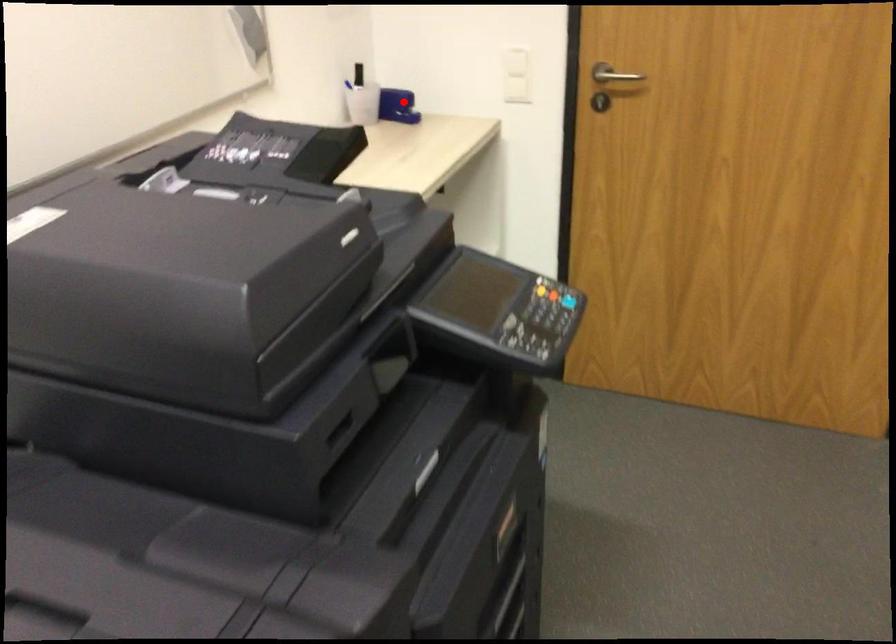
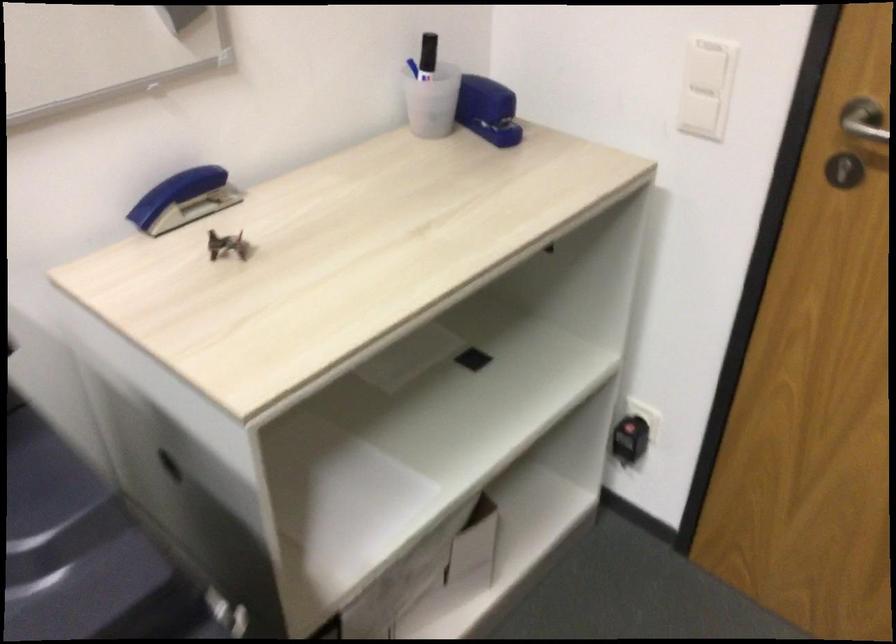
The point at the highlighted location is marked in the first image. Where is the corresponding point in the second image?

(487, 109)